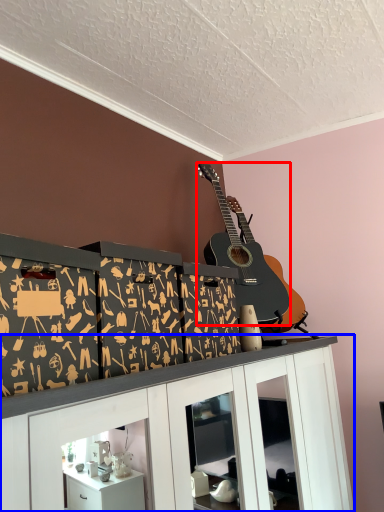
Question: Which object is further to the camera taking this photo, guitar (highlighted by a red box) or cabinetry (highlighted by a blue box)?

Choices:
 (A) guitar
 (B) cabinetry

Answer: (A)